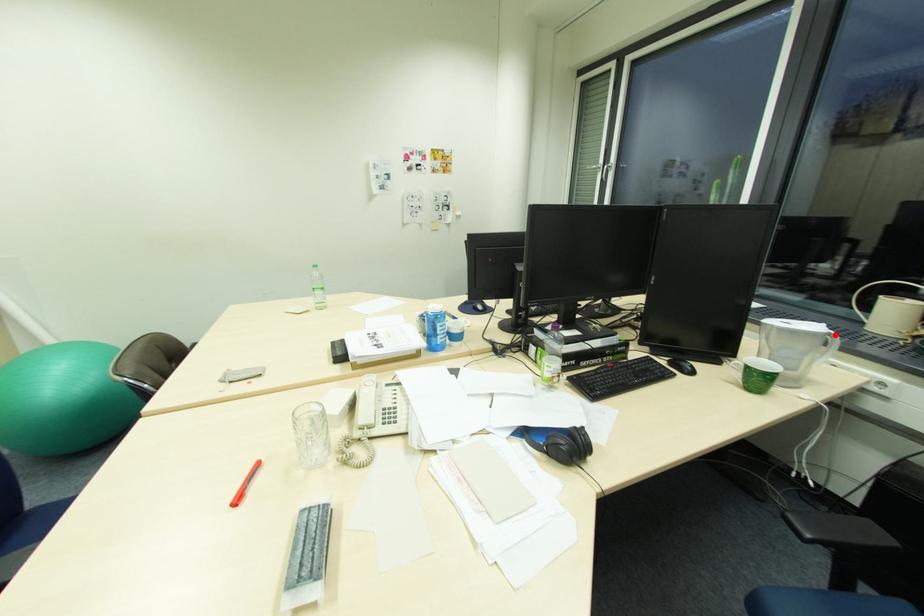
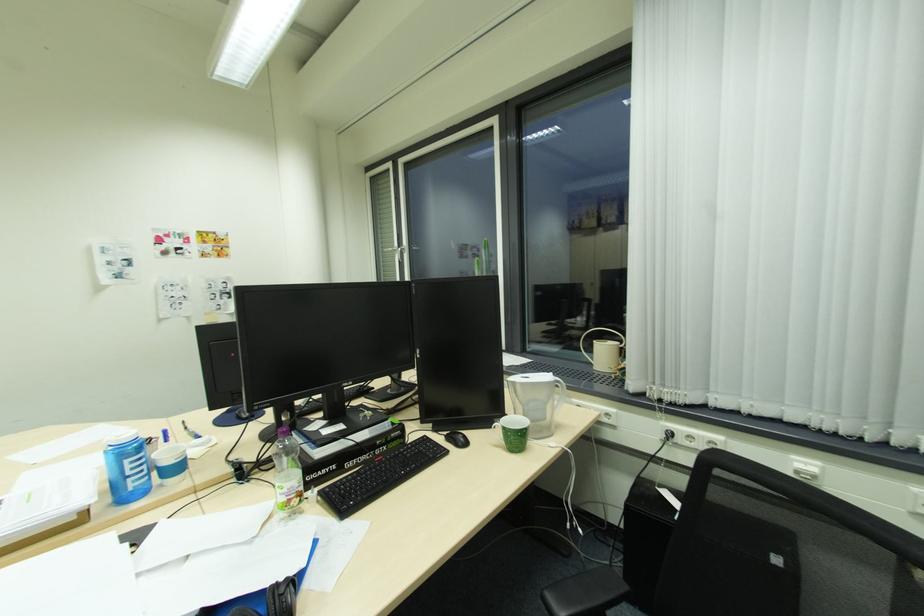
Locate, in the second image, the point that corresponds to the highlighted location in the first image.

(563, 382)